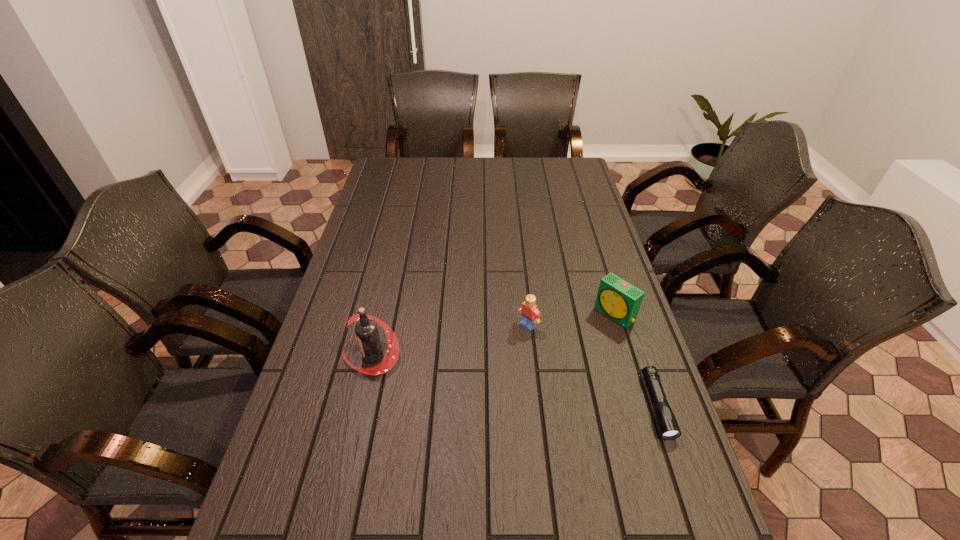
Locate an element on the screen. free space between the alarm clock and the shortest object is located at coordinates (636, 360).

Where is `free space between the leftmost object and the shortest object`? The image size is (960, 540). free space between the leftmost object and the shortest object is located at coordinates (515, 381).

Locate an element on the screen. Image resolution: width=960 pixels, height=540 pixels. free space between the alarm clock and the Lego is located at coordinates (571, 320).

Identify the location of vacant region between the leftmost object and the flashlight. (515, 381).

Where is `free spot between the alarm clock and the flashlight`? The height and width of the screenshot is (540, 960). free spot between the alarm clock and the flashlight is located at coordinates (636, 360).

Identify the location of free point between the alarm clock and the Lego. (571, 320).

What are the coordinates of `free space between the flashlight and the leftmost object` in the screenshot? It's located at tap(515, 381).

Locate an element on the screen. This screenshot has height=540, width=960. free space between the alarm clock and the flashlight is located at coordinates tap(636, 360).

Image resolution: width=960 pixels, height=540 pixels. What are the coordinates of `free space that is in between the second object from left to right and the alarm clock` in the screenshot? It's located at (571, 320).

Where is `free space between the second object from left to right and the shortest object`? free space between the second object from left to right and the shortest object is located at coordinates (592, 366).